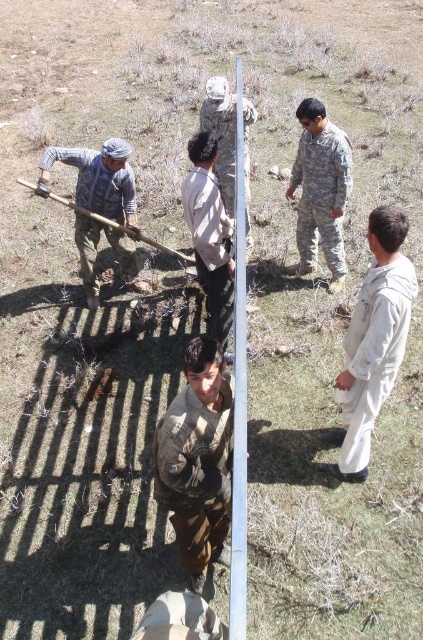
Does camouflage uniform at center have a lesser width compared to light brown fabric shirt at center?

No, camouflage uniform at center is not thinner than light brown fabric shirt at center.

The width and height of the screenshot is (423, 640). In order to click on camouflage uniform at center in this screenshot , I will do `click(321, 189)`.

The width and height of the screenshot is (423, 640). Identify the location of camouflage uniform at center. (321, 189).

Between white matte uniform at right and camouflage uniform at center, which one has more height?

With more height is white matte uniform at right.

Who is more forward, (346, 371) or (299, 248)?

Point (346, 371)

Is point (387, 339) positioned before point (326, 145)?

That is True.

At what (x,y) coordinates should I click in order to perform the action: click on white matte uniform at right. Please return your answer as a coordinate pair (x, y). The width and height of the screenshot is (423, 640). Looking at the image, I should click on pyautogui.click(x=373, y=342).

Which of these two, white matte uniform at right or wooden shovel at left, stands shorter?

wooden shovel at left is shorter.

Does point (387, 339) come farther from viewer compared to point (167, 250)?

No, it is not.

This screenshot has height=640, width=423. Identify the location of white matte uniform at right. (373, 342).